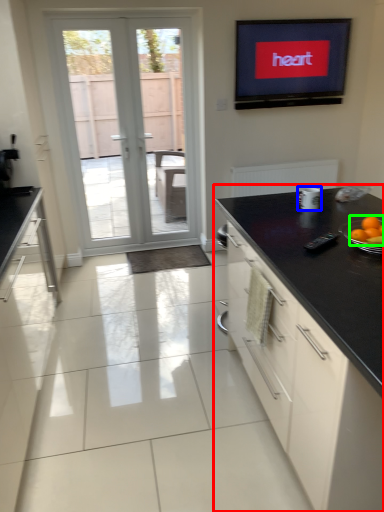
Question: Based on their relative distances, which object is farther from cabinetry (highlighted by a red box)? Choose from appliance (highlighted by a blue box) and orange (highlighted by a green box).

Choices:
 (A) appliance
 (B) orange

Answer: (A)